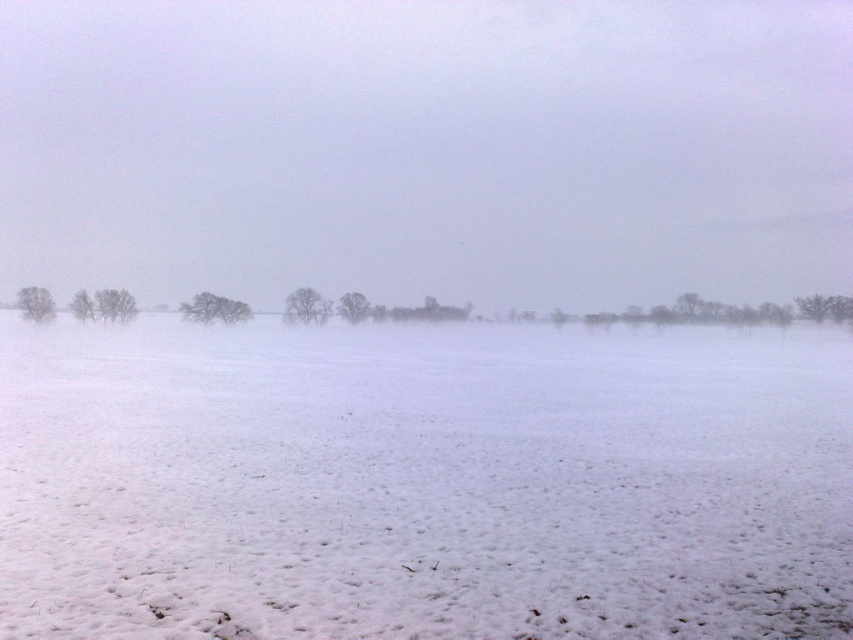
From the picture: You are standing in the winter landscape and notice two trees ahead. One is labeled as bare branches at center and the other as snowy bare tree at center. Which of these two trees is positioned to the left?

The bare branches at center is positioned to the left of the snowy bare tree at center.

You are standing in the winter landscape and notice two features on the left side of the image. Which one is more to the left between the snowy bare tree at left and the bare branches at left?

The bare branches at left are more to the left since the snowy bare tree at left is positioned on the right side of them.

You are standing at the origin point of the coordinate system. You want to walk to the snowy bare tree at left. What direction should you head towards?

The snowy bare tree at left is located at coordinate point 0.477 on the x axis and 0.136 on the y axis. Since the origin is at the bottom left corner of the image, you should move towards the right and slightly upwards to reach the snowy bare tree at left.